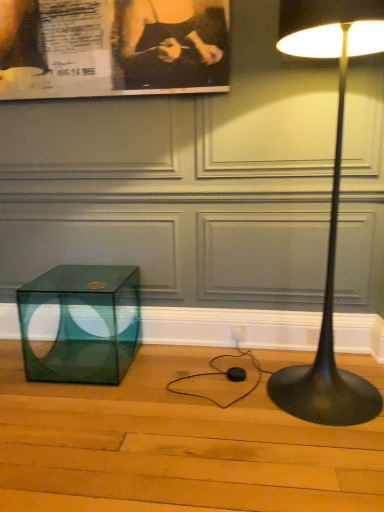
Identify the location of vacant area that is in front of transparent glass cube at lower left. The width and height of the screenshot is (384, 512). (77, 415).